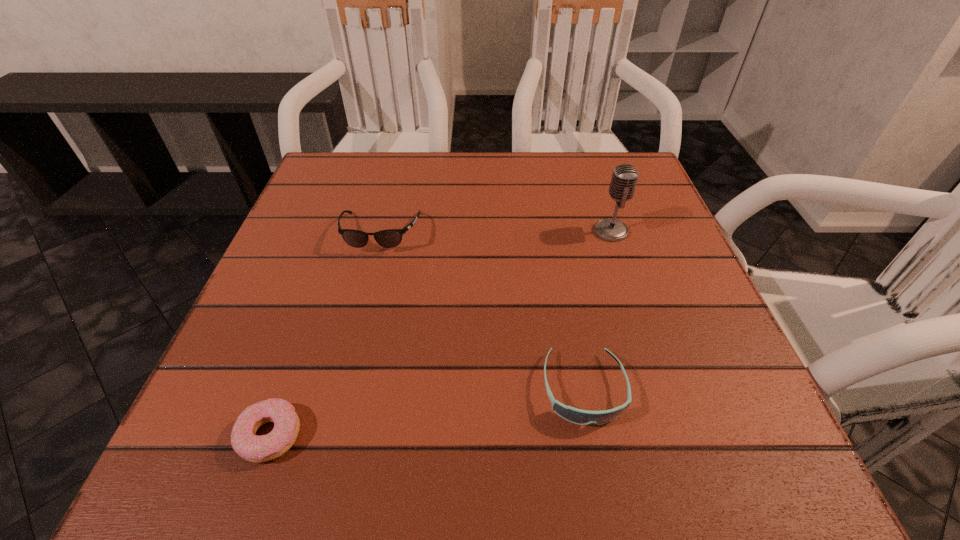
Find the location of a particular element. The height and width of the screenshot is (540, 960). the tallest object is located at coordinates (624, 179).

Locate an element on the screen. This screenshot has width=960, height=540. microphone is located at coordinates (624, 179).

You are a GUI agent. You are given a task and a screenshot of the screen. Output one action in this format:
    pyautogui.click(x=<x>, y=<y>)
    Task: Click on the third shortest object
    The height and width of the screenshot is (540, 960).
    Given the screenshot: What is the action you would take?
    pyautogui.click(x=389, y=238)

At what (x,y) coordinates should I click in order to perform the action: click on the second shortest object. Please return your answer as a coordinate pair (x, y). The width and height of the screenshot is (960, 540). Looking at the image, I should click on (581, 417).

Find the location of `the third object from left to right`. the third object from left to right is located at coordinates (581, 417).

Identify the location of the shortest object. Image resolution: width=960 pixels, height=540 pixels. (253, 448).

At what (x,y) coordinates should I click in order to perform the action: click on free location located on the back of the microphone. Please return your answer as a coordinate pair (x, y). The height and width of the screenshot is (540, 960). Looking at the image, I should click on (590, 167).

Identify the location of free spot located on the front-facing side of the second tallest object. This screenshot has width=960, height=540. (336, 410).

Locate an element on the screen. The height and width of the screenshot is (540, 960). vacant space located 0.140m on the right of the shortest object is located at coordinates (399, 435).

Where is `goggles that is at the near edge`? goggles that is at the near edge is located at coordinates (581, 417).